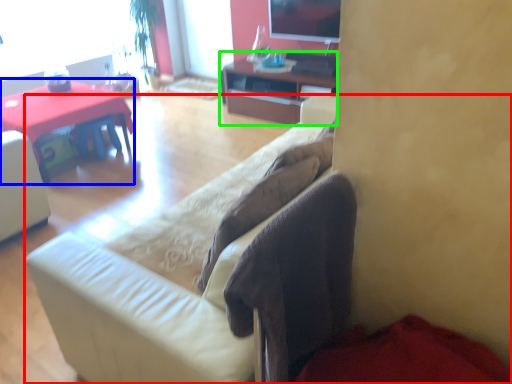
Question: Which object is positioned farthest from studio couch (highlighted by a red box)? Select from desk (highlighted by a blue box) and cabinetry (highlighted by a green box).

Choices:
 (A) desk
 (B) cabinetry

Answer: (B)